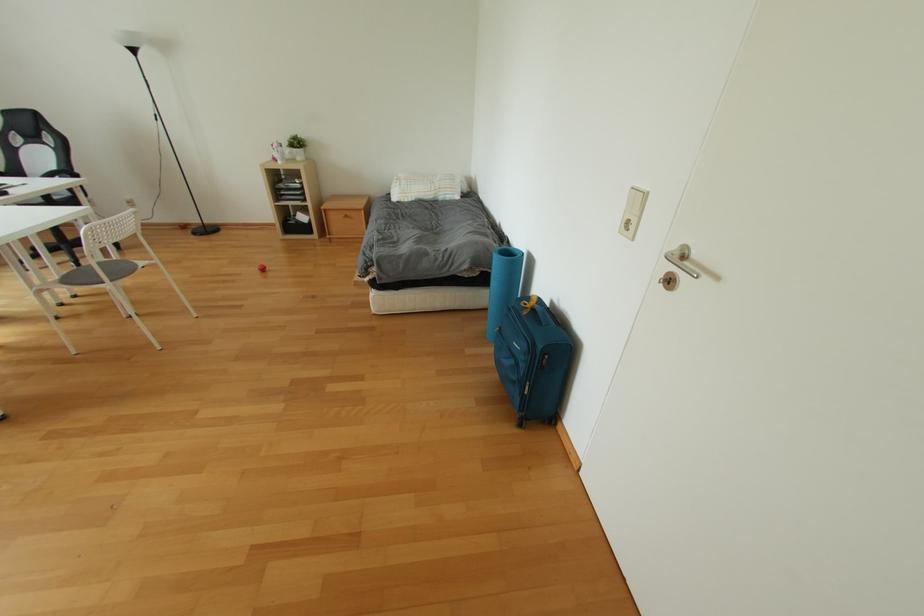
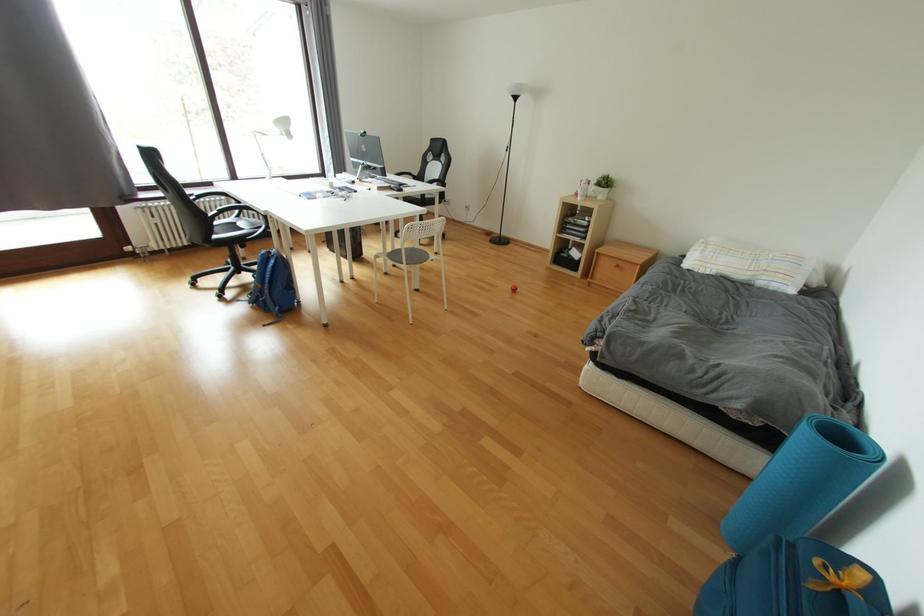
Question: How did the camera likely rotate?

Choices:
 (A) Left
 (B) Right
 (C) Up
 (D) Down

Answer: (A)